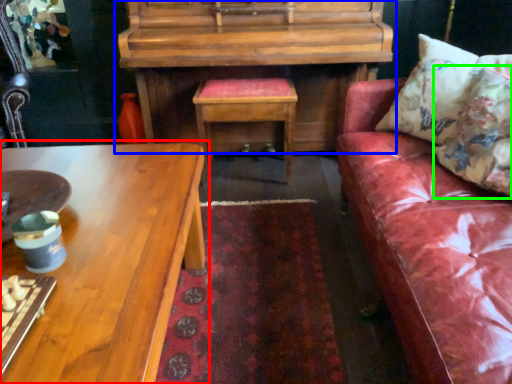
Question: Based on their relative distances, which object is farther from coffee table (highlighted by a red box)? Choose from piano (highlighted by a blue box) and pillow (highlighted by a green box).

Choices:
 (A) piano
 (B) pillow

Answer: (B)